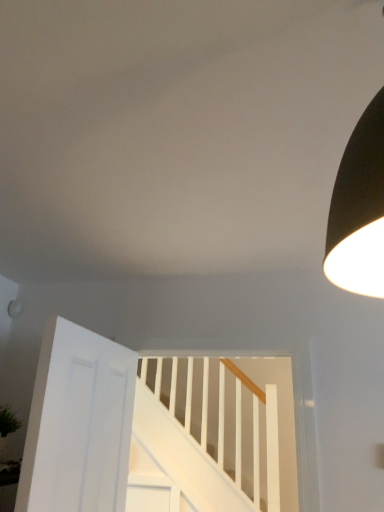
Question: From the image's perspective, is white matte door at lower left below white wooden stairs at center?

Choices:
 (A) no
 (B) yes

Answer: (A)

Question: Can you confirm if white matte door at lower left is shorter than white wooden stairs at center?

Choices:
 (A) no
 (B) yes

Answer: (B)

Question: From a real-world perspective, is white matte door at lower left positioned over white wooden stairs at center based on gravity?

Choices:
 (A) yes
 (B) no

Answer: (B)

Question: From a real-world perspective, is white matte door at lower left located beneath white wooden stairs at center?

Choices:
 (A) no
 (B) yes

Answer: (B)

Question: Is white matte door at lower left turned away from white wooden stairs at center?

Choices:
 (A) yes
 (B) no

Answer: (B)

Question: Is white wooden stairs at center surrounded by white matte door at lower left?

Choices:
 (A) yes
 (B) no

Answer: (B)

Question: Does white wooden stairs at center have a smaller size compared to white matte door at lower left?

Choices:
 (A) yes
 (B) no

Answer: (B)

Question: Is white wooden stairs at center thinner than white matte door at lower left?

Choices:
 (A) yes
 (B) no

Answer: (B)

Question: Is white wooden stairs at center at the left side of white matte door at lower left?

Choices:
 (A) yes
 (B) no

Answer: (B)

Question: Is white matte door at lower left a part of white wooden stairs at center?

Choices:
 (A) no
 (B) yes

Answer: (A)

Question: Would you say white wooden stairs at center is outside white matte door at lower left?

Choices:
 (A) no
 (B) yes

Answer: (B)

Question: Can you confirm if white wooden stairs at center is bigger than white matte door at lower left?

Choices:
 (A) yes
 (B) no

Answer: (A)

Question: Is white matte door at lower left wider or thinner than white wooden stairs at center?

Choices:
 (A) thin
 (B) wide

Answer: (A)